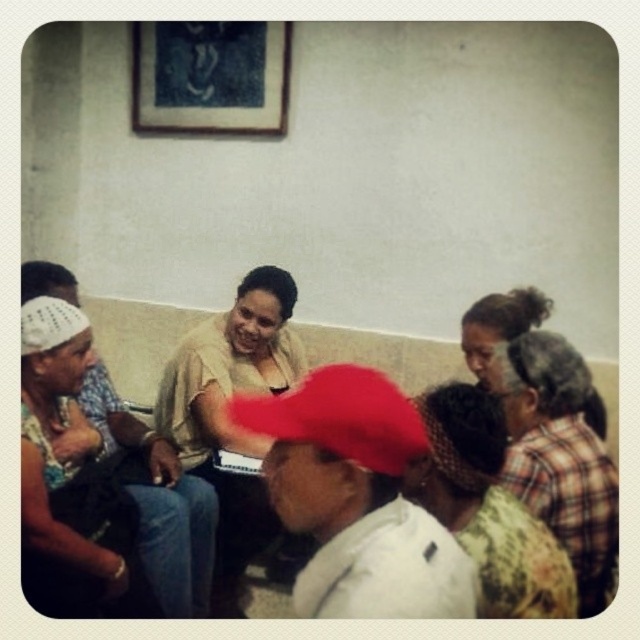
Consider the image. Can you confirm if matte beige sweater at center is positioned to the right of floral fabric dress at right?

Incorrect, matte beige sweater at center is not on the right side of floral fabric dress at right.

Identify the location of matte beige sweater at center. (227, 419).

Is matte beige sweater at center taller than floral fabric headscarf at center?

Yes.

Is point (237, 481) in front of point (493, 536)?

No, (237, 481) is further to viewer.

Is point (241, 336) closer to camera compared to point (412, 481)?

No, (241, 336) is further to viewer.

The image size is (640, 640). In order to click on matte beige sweater at center in this screenshot , I will do `click(227, 419)`.

Does matte beige sweater at center lie in front of white woven hat at left?

No, it is behind white woven hat at left.

Describe the element at coordinates (227, 419) in the screenshot. The image size is (640, 640). I see `matte beige sweater at center` at that location.

Image resolution: width=640 pixels, height=640 pixels. Find the location of `matte beige sweater at center`. matte beige sweater at center is located at coordinates (227, 419).